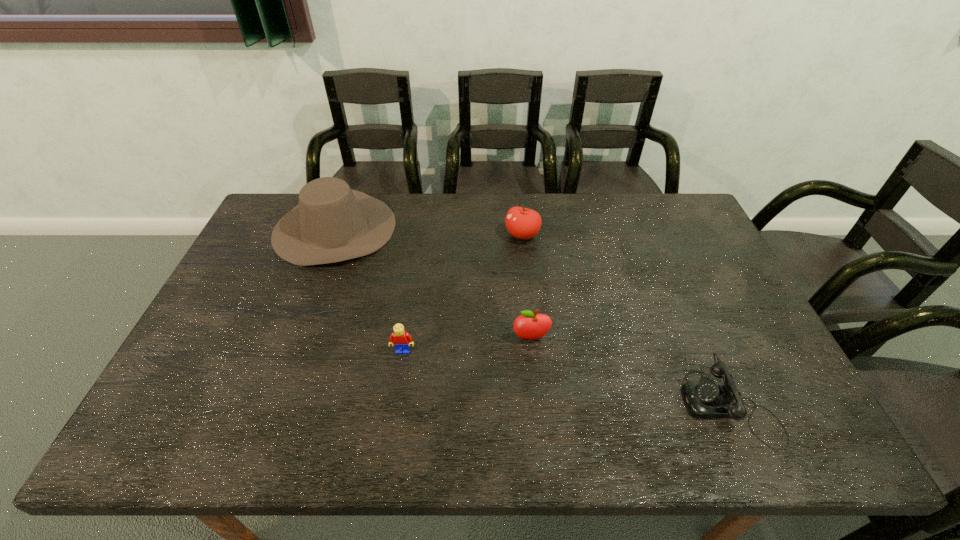
I want to click on free location located on the back of the third farthest object, so click(x=529, y=315).

Where is `vacant space located on the front-facing side of the fourth object from right to left`? vacant space located on the front-facing side of the fourth object from right to left is located at coordinates (391, 433).

The width and height of the screenshot is (960, 540). In order to click on vacant region located on the front-facing side of the nearest object in this screenshot , I will do `click(562, 404)`.

This screenshot has width=960, height=540. I want to click on free space located 0.290m on the front-facing side of the nearest object, so click(x=562, y=404).

Image resolution: width=960 pixels, height=540 pixels. What are the coordinates of `vacant space located on the front-facing side of the nearest object` in the screenshot? It's located at (639, 404).

The width and height of the screenshot is (960, 540). Find the location of `cowboy hat that is positioned at the far edge`. cowboy hat that is positioned at the far edge is located at coordinates (332, 223).

The image size is (960, 540). Identify the location of apple situated at the far edge. (523, 223).

At what (x,y) coordinates should I click in order to perform the action: click on object located at the near edge. Please return your answer as a coordinate pair (x, y). Looking at the image, I should click on (707, 399).

Where is `object located in the left edge section of the desktop`? Image resolution: width=960 pixels, height=540 pixels. object located in the left edge section of the desktop is located at coordinates (332, 223).

What are the coordinates of `object located at the right edge` in the screenshot? It's located at (707, 399).